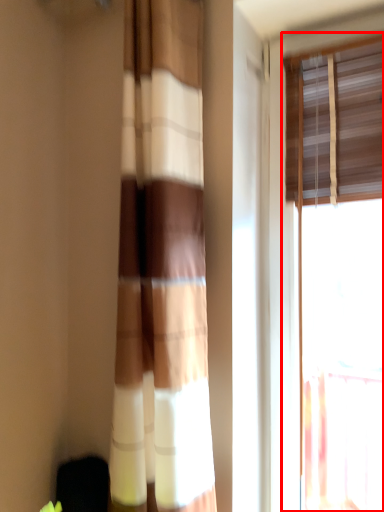
Question: From the image's perspective, considering the relative positions of window (annotated by the red box) and curtain in the image provided, where is window (annotated by the red box) located with respect to the staircase?

Choices:
 (A) below
 (B) above

Answer: (A)